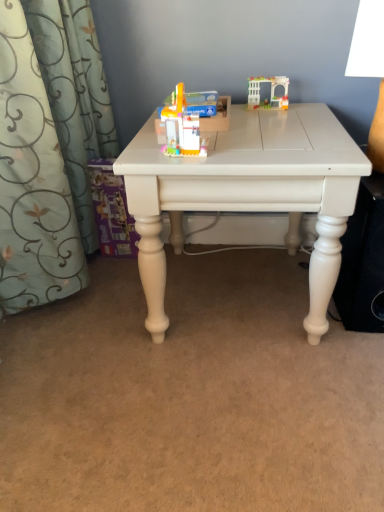
Where is `vacant space in front of white matte table at center`? Image resolution: width=384 pixels, height=512 pixels. vacant space in front of white matte table at center is located at coordinates (223, 413).